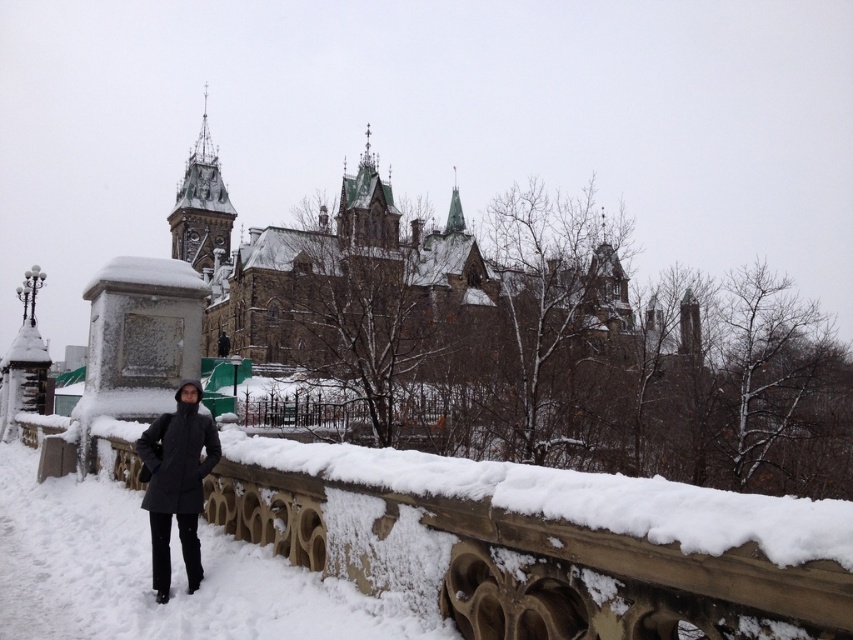
Does sanded stone balustrade at lower left have a greater height compared to dark gray coat at center?

Incorrect, sanded stone balustrade at lower left's height is not larger of dark gray coat at center's.

Image resolution: width=853 pixels, height=640 pixels. Describe the element at coordinates (543, 541) in the screenshot. I see `sanded stone balustrade at lower left` at that location.

Where is `sanded stone balustrade at lower left`? This screenshot has width=853, height=640. sanded stone balustrade at lower left is located at coordinates (543, 541).